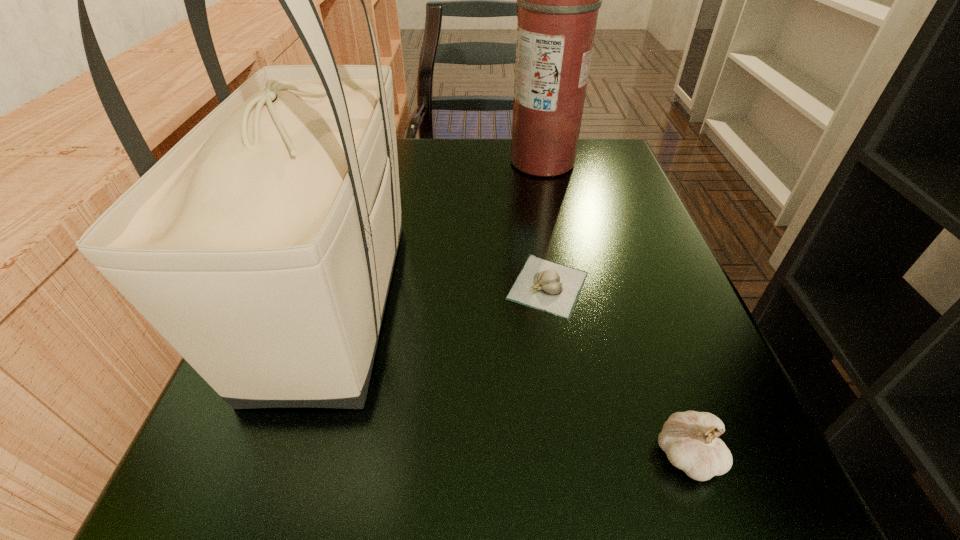
Identify the location of free space between the fire extinguisher and the nearer garlic. The height and width of the screenshot is (540, 960). (615, 309).

Locate an element on the screen. unoccupied area between the leftmost object and the right garlic is located at coordinates click(x=512, y=379).

Where is `object that ranks as the closest to the shortest object`? The width and height of the screenshot is (960, 540). object that ranks as the closest to the shortest object is located at coordinates (261, 246).

The image size is (960, 540). Find the location of `object that stands as the third closest to the shopping bag`. object that stands as the third closest to the shopping bag is located at coordinates (689, 439).

Where is `free location that satisfies the following two spatial constraints: 1. on the front-facing side of the fire extinguisher; 2. on the right side of the taller garlic`? Image resolution: width=960 pixels, height=540 pixels. free location that satisfies the following two spatial constraints: 1. on the front-facing side of the fire extinguisher; 2. on the right side of the taller garlic is located at coordinates (604, 456).

The height and width of the screenshot is (540, 960). What are the coordinates of `vacant area in the image that satisfies the following two spatial constraints: 1. on the front-facing side of the fire extinguisher; 2. with handles facing forward on the shopping bag` in the screenshot? It's located at (571, 301).

Where is `free spot that satisfies the following two spatial constraints: 1. with handles facing forward on the shopping bag; 2. on the right side of the third tallest object`? The image size is (960, 540). free spot that satisfies the following two spatial constraints: 1. with handles facing forward on the shopping bag; 2. on the right side of the third tallest object is located at coordinates (284, 456).

Find the location of `free spot that satisfies the following two spatial constraints: 1. with handles facing forward on the nearer garlic; 2. on the left side of the leftmost object`. free spot that satisfies the following two spatial constraints: 1. with handles facing forward on the nearer garlic; 2. on the left side of the leftmost object is located at coordinates (284, 456).

I want to click on free region that satisfies the following two spatial constraints: 1. on the back side of the third tallest object; 2. on the front-facing side of the fire extinguisher, so click(x=585, y=163).

Image resolution: width=960 pixels, height=540 pixels. What are the coordinates of `free space that satisfies the following two spatial constraints: 1. on the front-facing side of the farthest object; 2. with handles facing forward on the leftmost object` in the screenshot? It's located at 571,301.